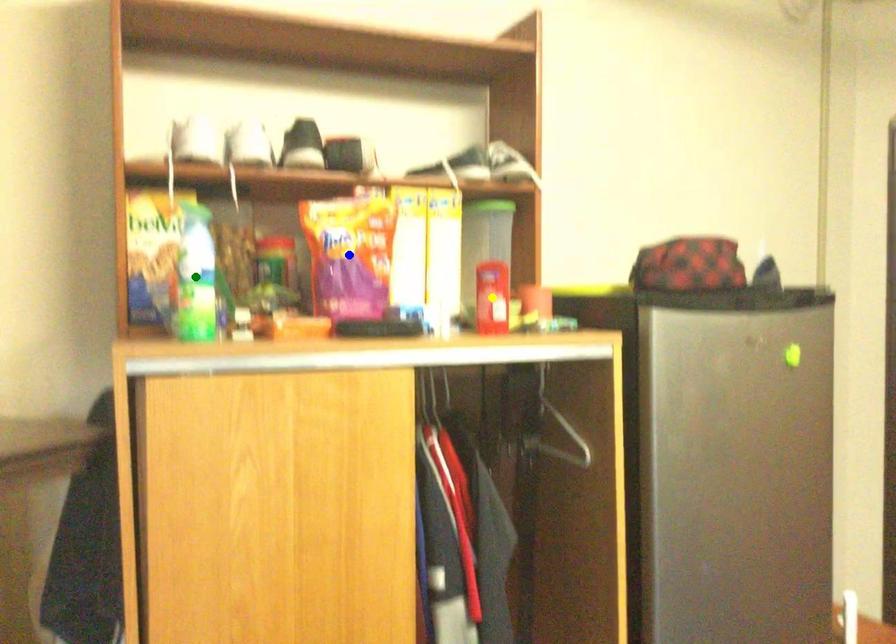
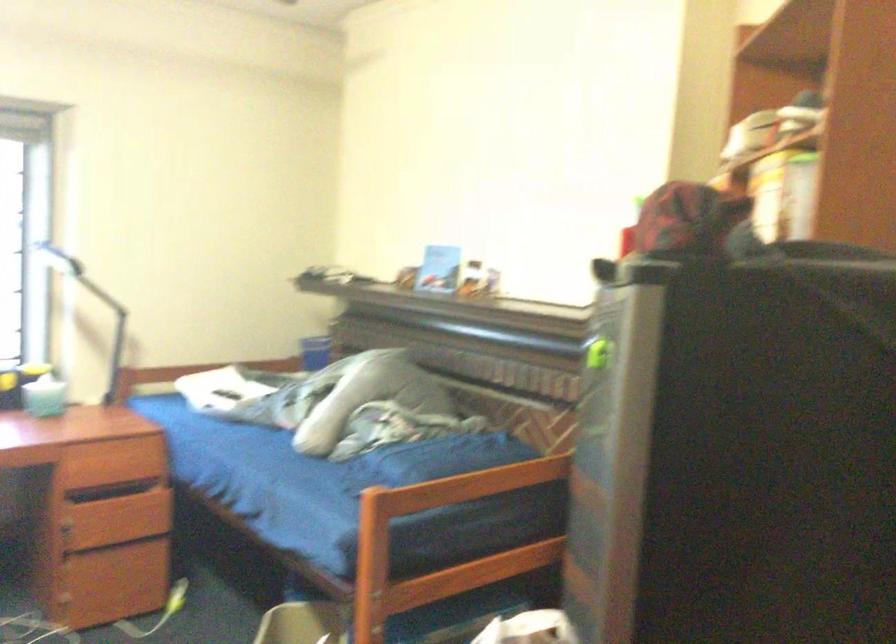
I am providing you with two images of the same scene from different viewpoints. Three points are marked in image1. Which point corresponds to a part or object that is occluded in image2?In image1, three points are marked. Which of them correspond to a part or object that is occluded in image2?Among the three points shown in image1, which one corresponds to a part or object that is no longer visible due to occlusion in image2?

yellow point, blue point, green point